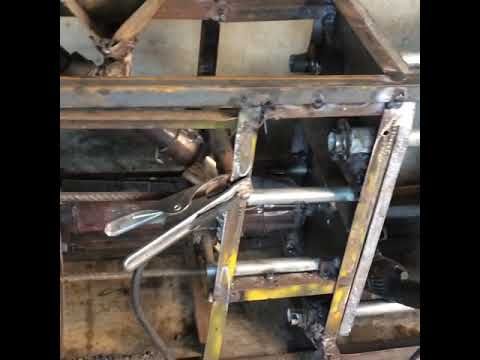
Find the location of `wall`. wall is located at coordinates (255, 45), (402, 16).